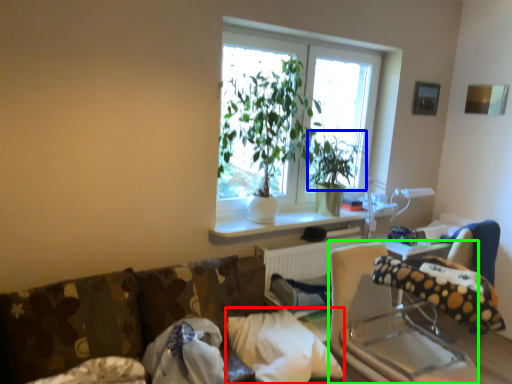
Question: Which object is positioned farthest from pillow (highlighted by a red box)? Select from plant (highlighted by a blue box) and rocking chair (highlighted by a green box).

Choices:
 (A) plant
 (B) rocking chair

Answer: (A)